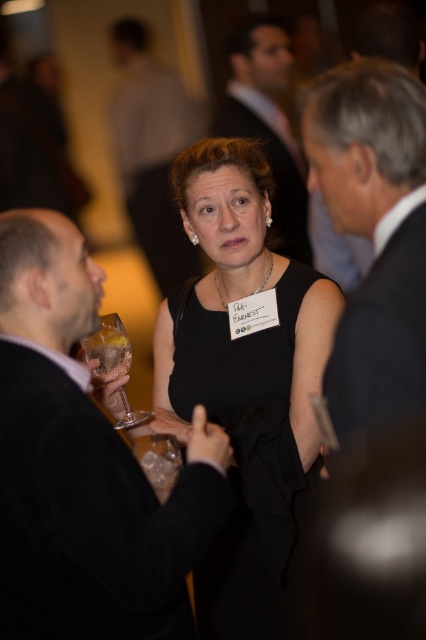
Is black matte suit at left to the left of matte black suit at center from the viewer's perspective?

In fact, black matte suit at left is to the right of matte black suit at center.

Between point (2, 547) and point (138, 225), which one is positioned behind?

The point (138, 225) is behind.

The height and width of the screenshot is (640, 426). I want to click on black matte suit at left, so click(x=91, y=516).

Looking at this image, measure the distance between point (322, 616) and camera.

Point (322, 616) and camera are 19.85 inches apart from each other.

Can you confirm if black suit at upper right is positioned below translucent glass at left?

Incorrect, black suit at upper right is not positioned below translucent glass at left.

Which is in front, point (385, 403) or point (118, 352)?

Point (385, 403)

Where is `black suit at upper right`? The image size is (426, 640). black suit at upper right is located at coordinates (374, 352).

Is black matte dress at center positioned behind clear glass wine glass at center?

Yes, it is behind clear glass wine glass at center.

Can you confirm if black matte dress at center is bigger than clear glass wine glass at center?

Indeed, black matte dress at center has a larger size compared to clear glass wine glass at center.

What do you see at coordinates (247, 458) in the screenshot? I see `black matte dress at center` at bounding box center [247, 458].

You are a GUI agent. You are given a task and a screenshot of the screen. Output one action in this format:
    pyautogui.click(x=<x>, y=<y>)
    Task: Click on the black matte dress at center
    
    Given the screenshot: What is the action you would take?
    pyautogui.click(x=247, y=458)